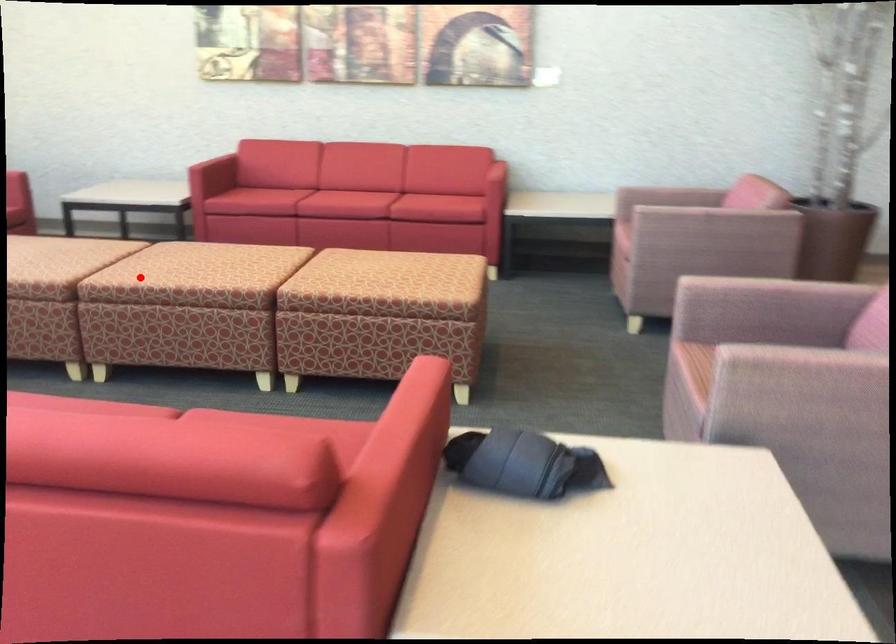
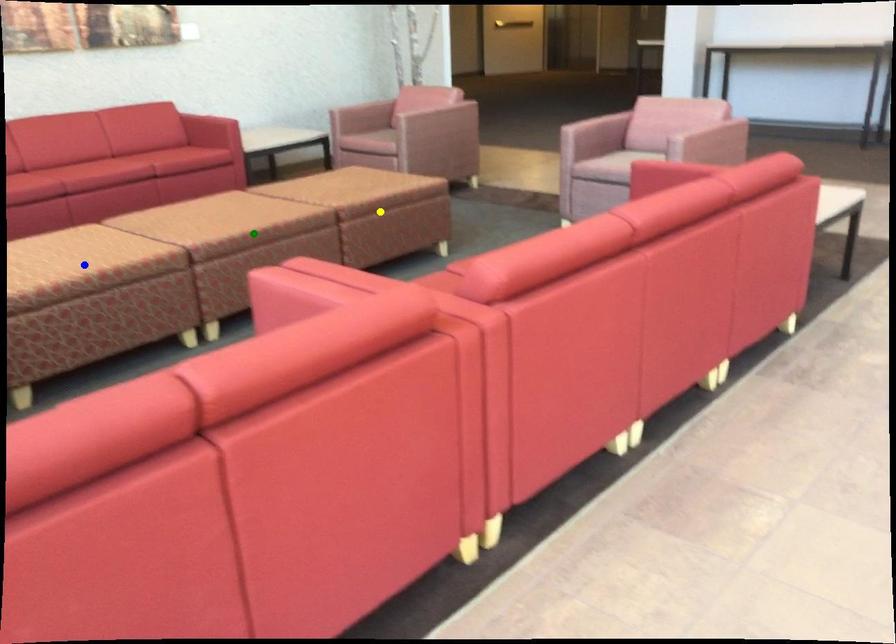
Question: I am providing you with two images of the same scene from different viewpoints. A red point is marked on the first image. You are given multiple points on the second image. Which point in image 2 represents the same 3d spot as the red point in image 1?

Choices:
 (A) green point
 (B) blue point
 (C) yellow point

Answer: (A)